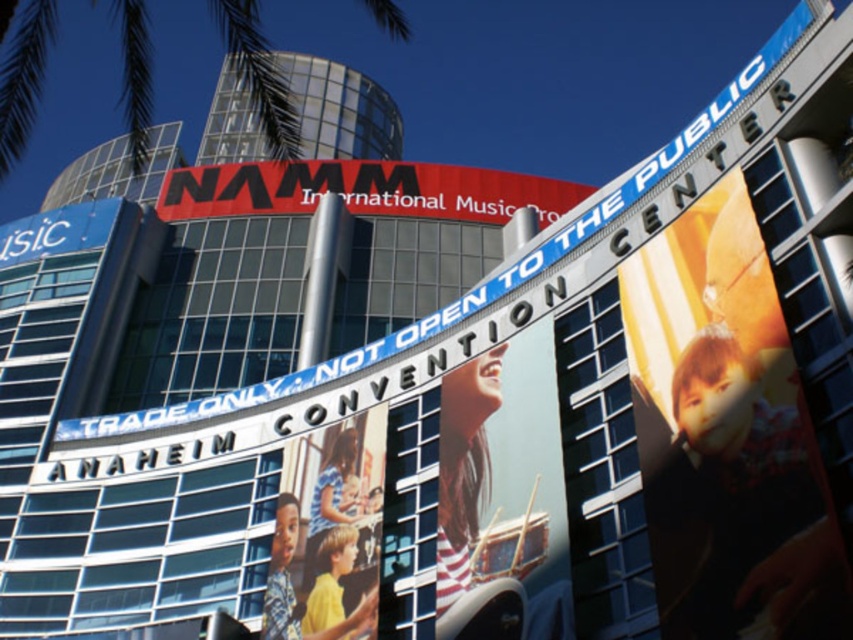
What do you see at coordinates (503, 484) in the screenshot? This screenshot has width=853, height=640. I see `matte black guitar at center` at bounding box center [503, 484].

Measure the distance between matte black guitar at center and green leafy palm tree at upper left.

32.37 meters

Is point (558, 584) more distant than point (283, 124)?

No, (558, 584) is closer to viewer.

Locate an element on the screen. matte black guitar at center is located at coordinates (503, 484).

Who is taller, matte plastic children at center or green leafy palm tree at upper left?

green leafy palm tree at upper left is taller.

Where is `matte plastic children at center`? matte plastic children at center is located at coordinates (328, 532).

Where is `matte plastic children at center`? This screenshot has width=853, height=640. matte plastic children at center is located at coordinates (328, 532).

Which is above, matte black child at right or green leafy palm tree at upper left?

green leafy palm tree at upper left is higher up.

Measure the distance between matte black child at right and camera.

They are 22.56 meters apart.

Is point (790, 480) in front of point (288, 99)?

Yes.

This screenshot has width=853, height=640. Find the location of `matte black child at right`. matte black child at right is located at coordinates [727, 436].